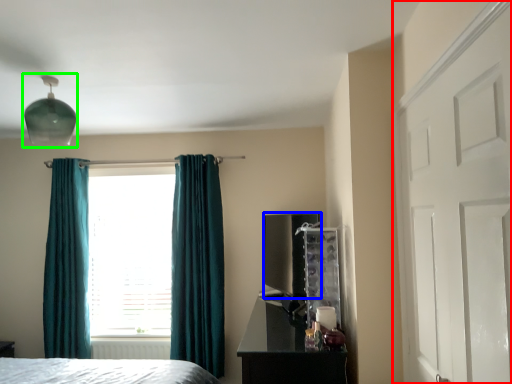
Question: Which is nearer to the door (highlighted by a red box)? appliance (highlighted by a blue box) or light fixture (highlighted by a green box).

Choices:
 (A) appliance
 (B) light fixture

Answer: (A)